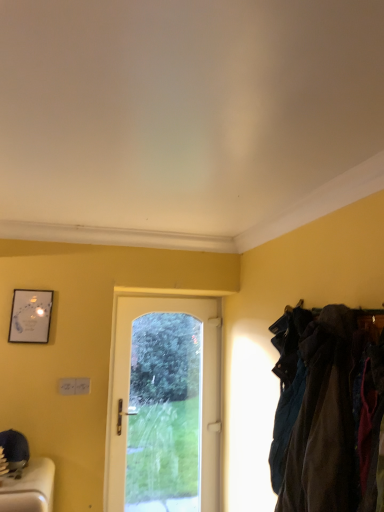
Question: Considering the positions of point (157, 458) and point (38, 336), is point (157, 458) closer or farther from the camera than point (38, 336)?

Choices:
 (A) closer
 (B) farther

Answer: (B)

Question: Is white glass door at center wider or thinner than matte silver picture frame at upper left?

Choices:
 (A) thin
 (B) wide

Answer: (B)

Question: Estimate the real-world distances between objects in this image. Which object is farther from the matte silver picture frame at upper left?

Choices:
 (A) dark blue fabric at right
 (B) white glass door at center

Answer: (A)

Question: Which object is the farthest from the dark blue fabric at right?

Choices:
 (A) white glass door at center
 (B) matte silver picture frame at upper left

Answer: (B)